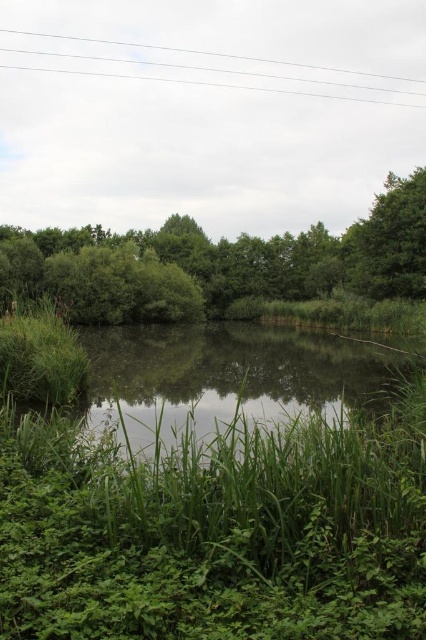
Between green grassy river at center and green leafy tree at upper right, which one has more height?

green leafy tree at upper right is taller.

Looking at this image, is green grassy river at center taller than green leafy tree at upper right?

In fact, green grassy river at center may be shorter than green leafy tree at upper right.

I want to click on green grassy river at center, so click(x=232, y=376).

Identify the location of green leafy tree at upper right. (389, 241).

Who is more distant from viewer, (394, 280) or (51, 54)?

The point (51, 54) is behind.

You are a GUI agent. You are given a task and a screenshot of the screen. Output one action in this format:
    pyautogui.click(x=<x>, y=<y>)
    Task: Click on the green leafy tree at upper right
    
    Given the screenshot: What is the action you would take?
    pyautogui.click(x=389, y=241)

Consider the image. Who is taller, green grassy river at center or green leafy tree at center?

green leafy tree at center is taller.

Between green grassy river at center and green leafy tree at center, which one has less height?

green grassy river at center is shorter.

The image size is (426, 640). Describe the element at coordinates (232, 376) in the screenshot. I see `green grassy river at center` at that location.

This screenshot has height=640, width=426. I want to click on green grassy river at center, so click(x=232, y=376).